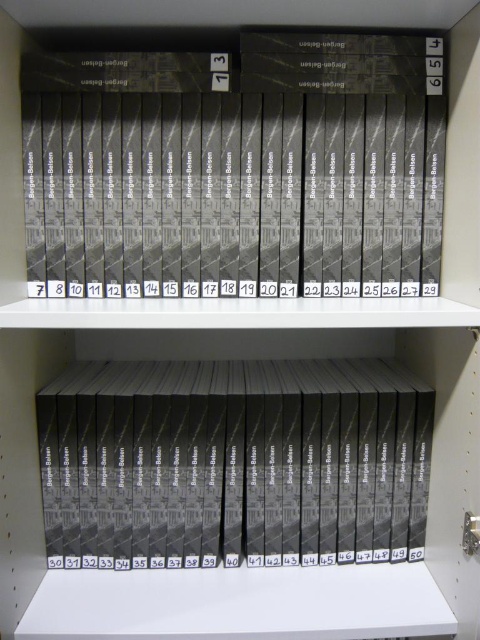
Is matte black book at upper center to the right of matte black book at center from the viewer's perspective?

No, matte black book at upper center is not to the right of matte black book at center.

Does matte black book at upper center have a greater height compared to matte black book at center?

Correct, matte black book at upper center is much taller as matte black book at center.

You are a GUI agent. You are given a task and a screenshot of the screen. Output one action in this format:
    pyautogui.click(x=<x>, y=<y>)
    Task: Click on the matte black book at upper center
    
    Given the screenshot: What is the action you would take?
    pyautogui.click(x=237, y=170)

Identify the location of matte black book at upper center. This screenshot has width=480, height=640. (237, 170).